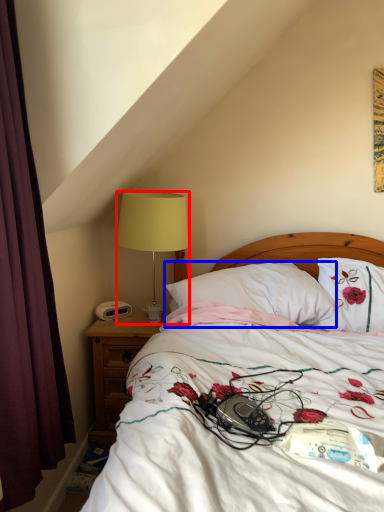
Question: Which of the following is the closest to the observer, lamp (highlighted by a red box) or pillow (highlighted by a blue box)?

Choices:
 (A) lamp
 (B) pillow

Answer: (B)